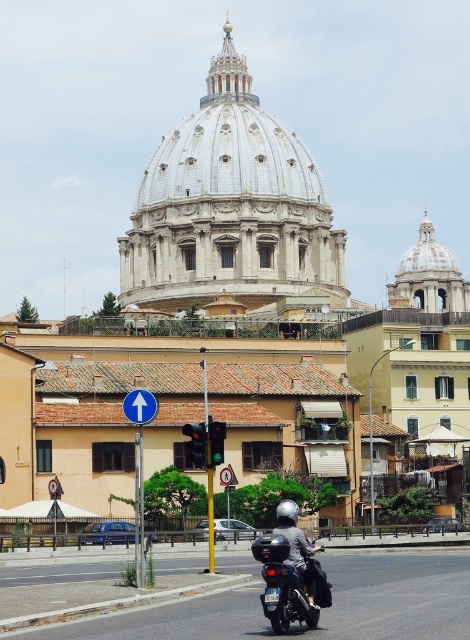
You are a photographer standing in the street and want to capture both the shiny black motorcycle at center and the blue metallic signpost at upper center in a single frame. Which object should you position closer to the edge of your camera frame to ensure both fit in the shot?

The shiny black motorcycle at center is thinner than the blue metallic signpost at upper center, so you should position the blue metallic signpost at upper center closer to the edge of your camera frame to ensure both fit in the shot.

You are a tourist standing in front of St. Peter Basilica and you see the white marble dome at center and the silver metallic helmet at center. Which object is closer to you?

The silver metallic helmet at center is closer to you because the white marble dome at center is further to the viewer than the silver metallic helmet at center.

You are a tourist standing at the street level in Vatican City. You see the shiny black motorcycle at center and the blue metallic signpost at upper center. Which object is closer to you?

The shiny black motorcycle at center is closer to you because it is in front of the blue metallic signpost at upper center.